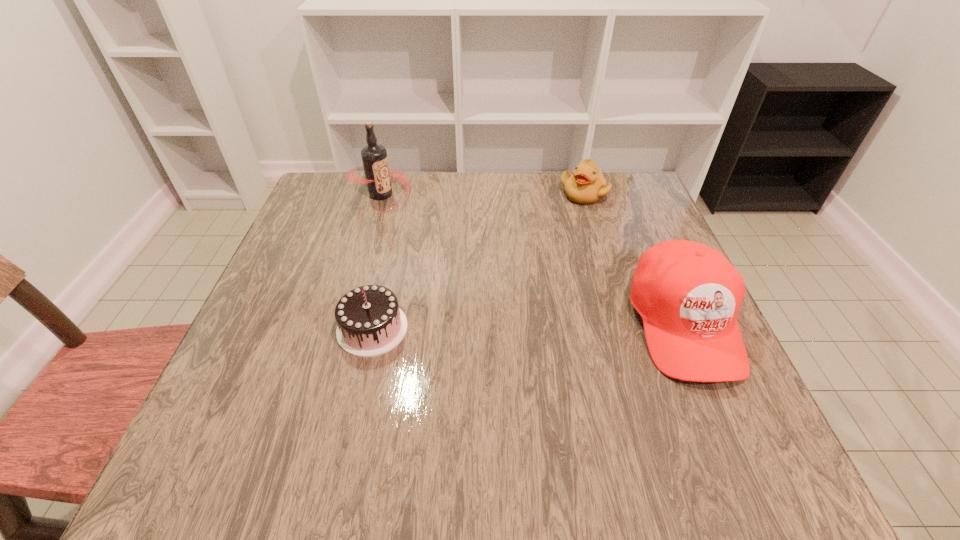
In order to click on free region at the far edge of the desktop in this screenshot , I will do `click(397, 186)`.

What are the coordinates of `vacant space at the near edge of the desktop` in the screenshot? It's located at (454, 420).

In the image, there is a desktop. Where is `vacant space at the left edge`? This screenshot has width=960, height=540. vacant space at the left edge is located at coordinates (326, 325).

Where is `free space at the right edge of the desktop`? free space at the right edge of the desktop is located at coordinates (631, 282).

Image resolution: width=960 pixels, height=540 pixels. In order to click on free space at the far right corner of the desktop in this screenshot , I will do `click(636, 196)`.

Image resolution: width=960 pixels, height=540 pixels. In the image, there is a desktop. Identify the location of vacant space at the near right corner. (720, 389).

Locate an element on the screen. Image resolution: width=960 pixels, height=540 pixels. vacant region between the duckling and the root beer is located at coordinates (482, 194).

Identify the location of free space between the third shortest object and the duckling. The image size is (960, 540). (634, 259).

You are a GUI agent. You are given a task and a screenshot of the screen. Output one action in this format:
    pyautogui.click(x=<x>, y=<y>)
    Task: Click on the empty location between the duckling and the baseball cap
    This screenshot has height=540, width=960.
    Given the screenshot: What is the action you would take?
    pyautogui.click(x=634, y=259)

What are the coordinates of `free space between the second tallest object and the tallest object` in the screenshot? It's located at (532, 259).